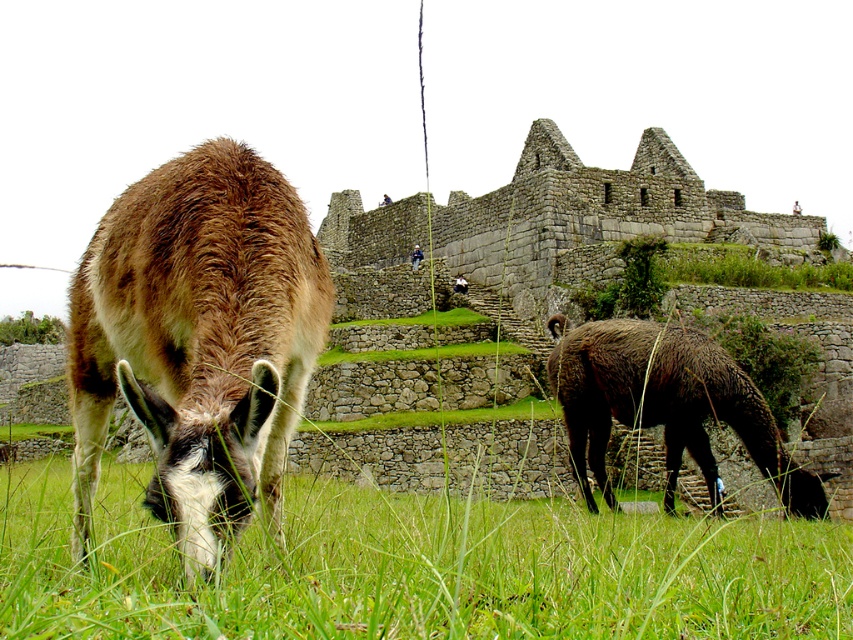
Question: Considering the real-world distances, which object is farthest from the brown woolen llama at lower left?

Choices:
 (A) brown fuzzy llama at left
 (B) dark brown woolen llama at right

Answer: (A)

Question: Which of these objects is positioned farthest from the dark brown woolen llama at right?

Choices:
 (A) brown fuzzy llama at left
 (B) brown woolen llama at lower left

Answer: (A)

Question: Does brown woolen llama at lower left appear under dark brown woolen llama at right?

Choices:
 (A) yes
 (B) no

Answer: (A)

Question: In this image, where is brown woolen llama at lower left located relative to brown fuzzy llama at left?

Choices:
 (A) left
 (B) right

Answer: (B)

Question: Is brown fuzzy llama at left smaller than dark brown woolen llama at right?

Choices:
 (A) no
 (B) yes

Answer: (B)

Question: Estimate the real-world distances between objects in this image. Which object is farther from the brown fuzzy llama at left?

Choices:
 (A) brown woolen llama at lower left
 (B) dark brown woolen llama at right

Answer: (B)